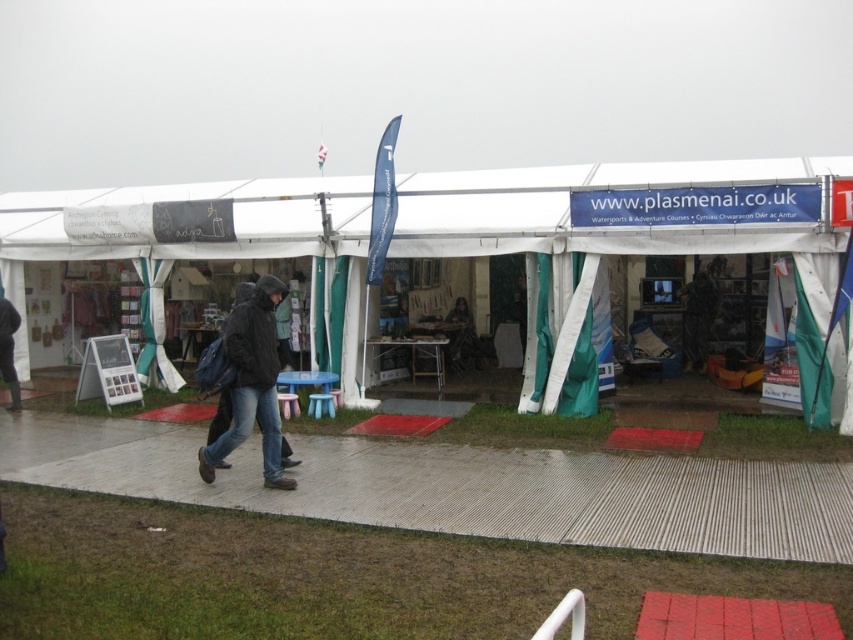
Question: Which object appears closest to the camera in this image?

Choices:
 (A) black matte jacket at left
 (B) black matte jacket at center
 (C) white fabric tent at center
 (D) dark gray fabric jacket at center

Answer: (B)

Question: Which of the following is the farthest from the observer?

Choices:
 (A) (262, 349)
 (B) (459, 298)
 (C) (524, 195)

Answer: (B)

Question: Is black matte jacket at left closer to the viewer compared to dark gray fabric jacket at center?

Choices:
 (A) no
 (B) yes

Answer: (B)

Question: Estimate the real-world distances between objects in this image. Which object is closer to the dark gray fabric jacket at center?

Choices:
 (A) black matte jacket at center
 (B) white fabric tent at center

Answer: (B)

Question: In this image, where is white fabric tent at center located relative to black matte jacket at left?

Choices:
 (A) below
 (B) above

Answer: (B)

Question: Is black matte jacket at center thinner than dark gray fabric jacket at center?

Choices:
 (A) yes
 (B) no

Answer: (B)